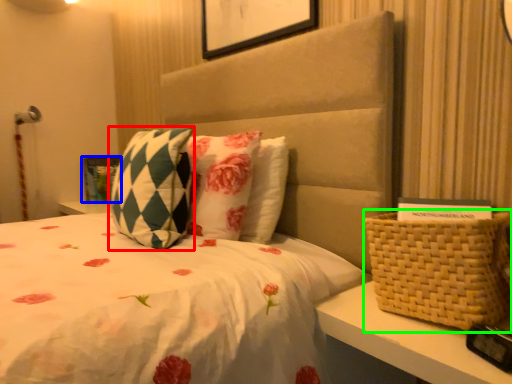
Question: Estimate the real-world distances between objects in this image. Which object is closer to pillow (highlighted by a red box), picture frame (highlighted by a blue box) or basket (highlighted by a green box)?

Choices:
 (A) picture frame
 (B) basket

Answer: (B)